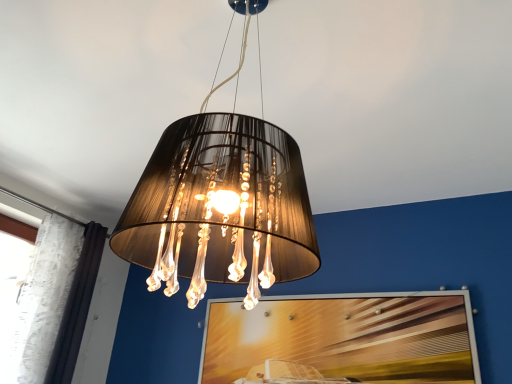
Question: Considering the relative sizes of white lace curtain at left and matte black lampshade at center in the image provided, is white lace curtain at left taller than matte black lampshade at center?

Choices:
 (A) yes
 (B) no

Answer: (A)

Question: Is white lace curtain at left at the left side of matte black lampshade at center?

Choices:
 (A) yes
 (B) no

Answer: (A)

Question: Is white lace curtain at left shorter than matte black lampshade at center?

Choices:
 (A) no
 (B) yes

Answer: (A)

Question: Does white lace curtain at left have a larger size compared to matte black lampshade at center?

Choices:
 (A) no
 (B) yes

Answer: (A)

Question: Does white lace curtain at left have a smaller size compared to matte black lampshade at center?

Choices:
 (A) yes
 (B) no

Answer: (A)

Question: From the image's perspective, is white lace curtain at left under matte black lampshade at center?

Choices:
 (A) no
 (B) yes

Answer: (B)

Question: Is wooden textured picture frame at center oriented towards matte black lampshade at center?

Choices:
 (A) no
 (B) yes

Answer: (B)

Question: Is wooden textured picture frame at center oriented away from matte black lampshade at center?

Choices:
 (A) yes
 (B) no

Answer: (B)

Question: From the image's perspective, is wooden textured picture frame at center located above matte black lampshade at center?

Choices:
 (A) no
 (B) yes

Answer: (A)

Question: Is wooden textured picture frame at center further to camera compared to matte black lampshade at center?

Choices:
 (A) yes
 (B) no

Answer: (A)

Question: Does wooden textured picture frame at center appear on the right side of matte black lampshade at center?

Choices:
 (A) yes
 (B) no

Answer: (A)

Question: From a real-world perspective, is wooden textured picture frame at center on top of matte black lampshade at center?

Choices:
 (A) yes
 (B) no

Answer: (B)

Question: From the image's perspective, does matte black lampshade at center appear lower than wooden textured picture frame at center?

Choices:
 (A) yes
 (B) no

Answer: (B)